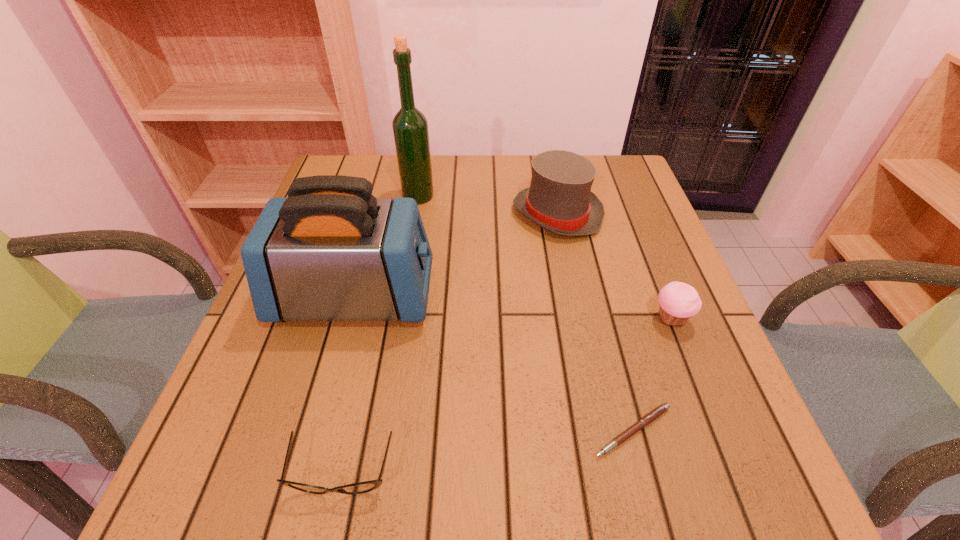
You are a GUI agent. You are given a task and a screenshot of the screen. Output one action in this format:
    pyautogui.click(x=<x>, y=<y>)
    Task: Click on the free spot located on the left of the third shortest object
    The height and width of the screenshot is (540, 960).
    Given the screenshot: What is the action you would take?
    pyautogui.click(x=468, y=319)

You are a GUI agent. You are given a task and a screenshot of the screen. Output one action in this format:
    pyautogui.click(x=<x>, y=<y>)
    Task: Click on the liquor that is at the far edge
    The height and width of the screenshot is (540, 960).
    Given the screenshot: What is the action you would take?
    click(410, 127)

At what (x,y) coordinates should I click in order to perform the action: click on dress hat at the far edge. Please return your answer as a coordinate pair (x, y). Looking at the image, I should click on (559, 199).

Where is `spectacles that is positioned at the near edge`? spectacles that is positioned at the near edge is located at coordinates (362, 487).

Where is `pen located in the near edge section of the desktop`? pen located in the near edge section of the desktop is located at coordinates (654, 414).

The image size is (960, 540). Find the location of `toaster that is at the left edge`. toaster that is at the left edge is located at coordinates (331, 251).

Locate an element on the screen. This screenshot has height=540, width=960. spectacles at the left edge is located at coordinates (362, 487).

The width and height of the screenshot is (960, 540). Find the location of `dress hat that is at the right edge`. dress hat that is at the right edge is located at coordinates (559, 199).

Find the location of a particular element. The height and width of the screenshot is (540, 960). cupcake that is at the right edge is located at coordinates (678, 301).

Locate an element on the screen. The image size is (960, 540). pen that is at the right edge is located at coordinates (654, 414).